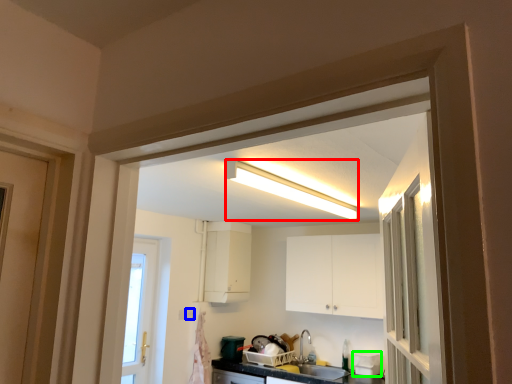
Question: Which object is the farthest from light fixture (highlighted by a red box)? Choose among these: electric outlet (highlighted by a blue box) or appliance (highlighted by a green box).

Choices:
 (A) electric outlet
 (B) appliance

Answer: (A)